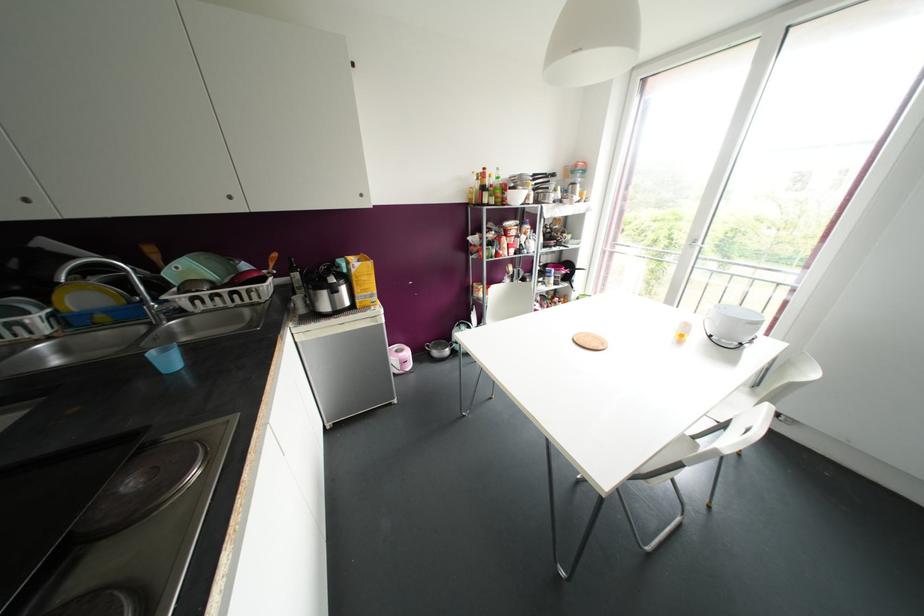
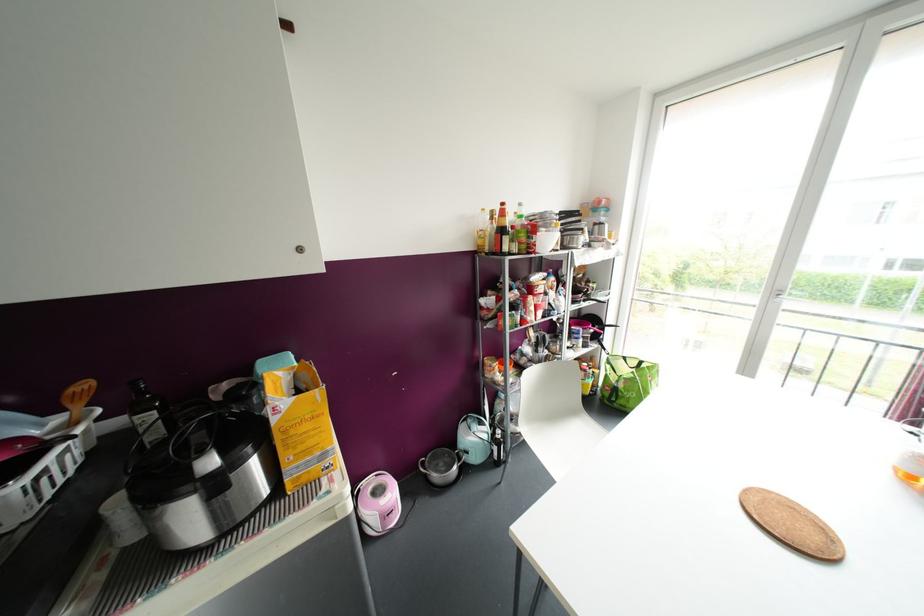
Where in the second image is the point corresponding to point (407, 353) from the first image?

(392, 493)